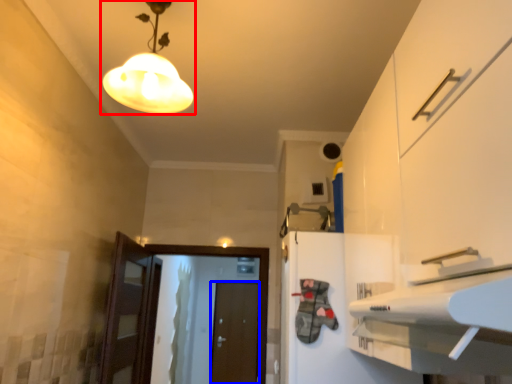
Question: Among these objects, which one is farthest to the camera, lamp (highlighted by a red box) or door (highlighted by a blue box)?

Choices:
 (A) lamp
 (B) door

Answer: (B)